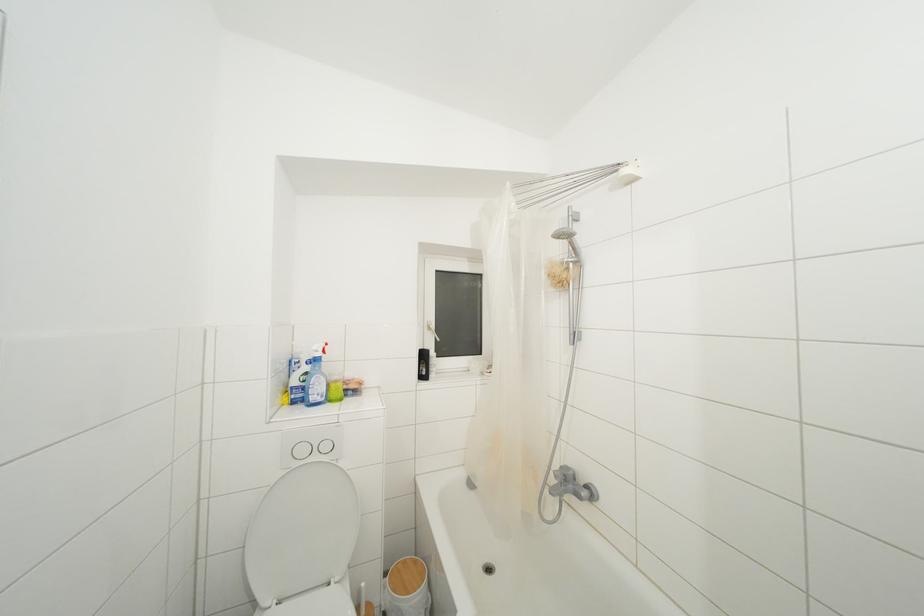
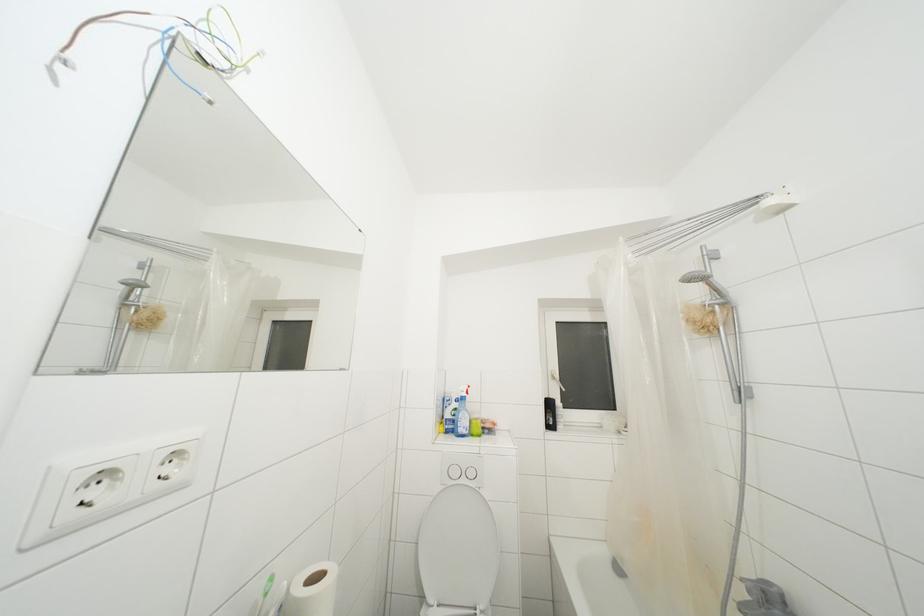
Question: The camera is either moving clockwise (left) or counter-clockwise (right) around the object. The first image is from the beginning of the video and the second image is from the end. Is the camera moving left or right when shooting the video?

Choices:
 (A) Left
 (B) Right

Answer: (B)